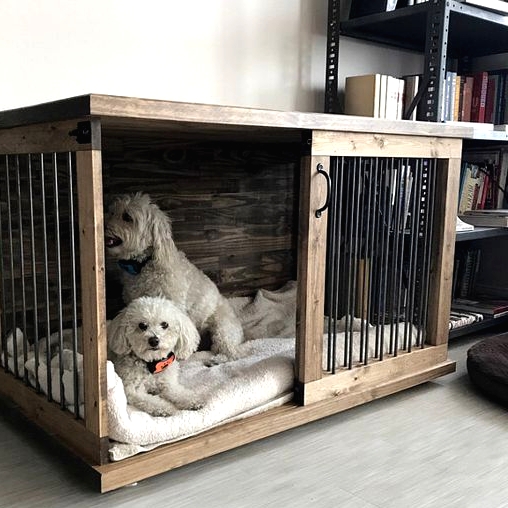
I want to click on dog crate, so click(59, 426), click(88, 243), click(57, 236), click(234, 231), click(320, 261), click(408, 236), click(454, 194).